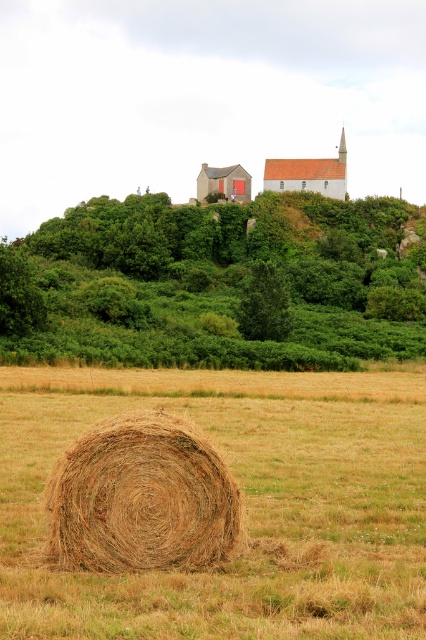
You are standing at the base of the large hay bale in the foreground of the rural landscape. Looking towards the horizon, you notice a point marked at coordinates (224, 280) on your map. What does this point represent in the scene?

The point at (224, 280) corresponds to the green leafy hillside at upper center.

You are standing in the rural landscape and want to take a photo of the red brick church at upper center. There is a brown straw bale at center in the way. Which direction should you move to avoid the straw bale blocking the view?

You should move to the right to avoid the brown straw bale at center blocking the view of the red brick church at upper center, since the brown straw bale at center is positioned to the left of the church.